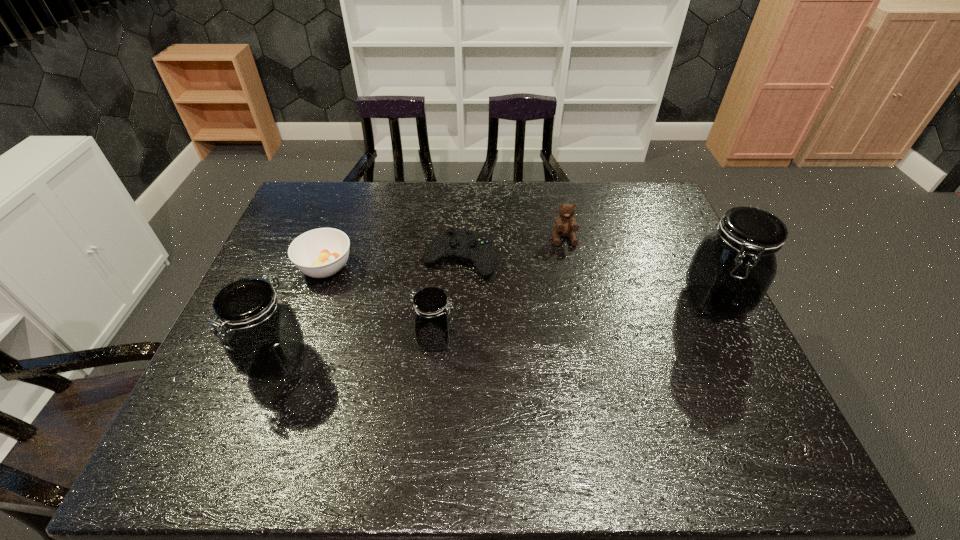
Where is `the leftmost jar`? The image size is (960, 540). the leftmost jar is located at coordinates (261, 334).

The width and height of the screenshot is (960, 540). In order to click on the fifth shortest object in this screenshot , I will do `click(261, 334)`.

Where is `the third tallest object`? The width and height of the screenshot is (960, 540). the third tallest object is located at coordinates (432, 322).

This screenshot has height=540, width=960. I want to click on the shortest jar, so click(432, 322).

Where is `the rightmost object`? This screenshot has width=960, height=540. the rightmost object is located at coordinates tap(733, 267).

At what (x,y) coordinates should I click in order to perform the action: click on the fifth tallest object. Please return your answer as a coordinate pair (x, y). Image resolution: width=960 pixels, height=540 pixels. Looking at the image, I should click on (323, 252).

The height and width of the screenshot is (540, 960). I want to click on the shortest object, so click(477, 248).

Identify the location of the fifth object from left to right. The height and width of the screenshot is (540, 960). (566, 225).

Identify the location of the fourth tallest object. This screenshot has height=540, width=960. (566, 225).

Locate an element on the screen. Image resolution: width=960 pixels, height=540 pixels. vacant space located 0.060m on the lid of the leftmost jar is located at coordinates [256, 415].